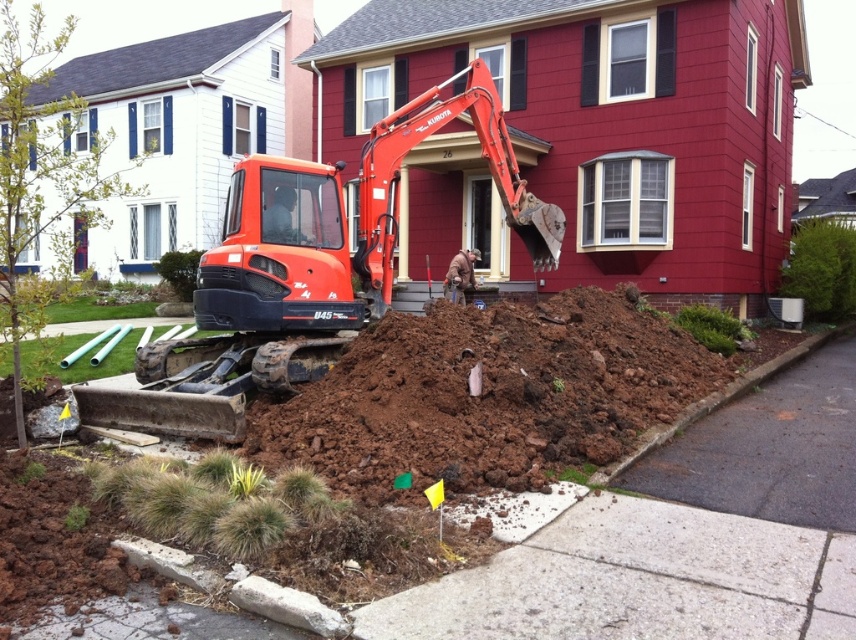
Question: Which point appears closest to the camera in this image?

Choices:
 (A) (843, 508)
 (B) (337, 403)
 (C) (476, 109)
 (D) (599, 557)

Answer: (D)

Question: Which object is positioned closest to the gray concrete sidewalk at lower center?

Choices:
 (A) dark gray asphalt at lower right
 (B) orange metallic excavator at center
 (C) brown dirt at center

Answer: (A)

Question: Where is brown dirt at center located in relation to gray concrete sidewalk at lower center in the image?

Choices:
 (A) below
 (B) above

Answer: (B)

Question: Which object appears farthest from the camera in this image?

Choices:
 (A) orange metallic excavator at center
 (B) brown dirt at center
 (C) dark gray asphalt at lower right
 (D) gray concrete sidewalk at lower center

Answer: (A)

Question: Where is brown dirt at center located in relation to orange metallic excavator at center in the image?

Choices:
 (A) below
 (B) above

Answer: (A)

Question: Does brown dirt at center have a greater width compared to dark gray asphalt at lower right?

Choices:
 (A) yes
 (B) no

Answer: (B)